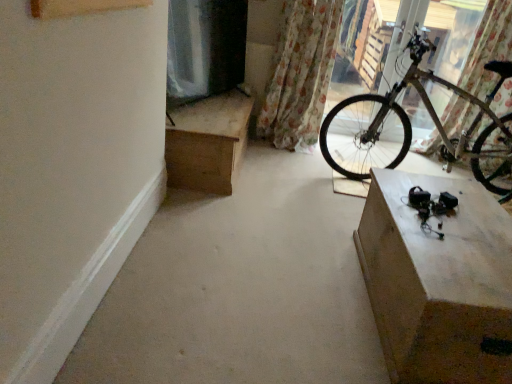
Question: Is wooden desk at upper left positioned beyond the bounds of floral fabric curtain at upper right, which appears as the 2th curtain when viewed from the left?

Choices:
 (A) no
 (B) yes

Answer: (B)

Question: Can you confirm if wooden desk at upper left is wider than floral fabric curtain at upper right, which appears as the 2th curtain when viewed from the left?

Choices:
 (A) yes
 (B) no

Answer: (A)

Question: From the image's perspective, is wooden desk at upper left under floral fabric curtain at upper right, which appears as the 2th curtain when viewed from the left?

Choices:
 (A) no
 (B) yes

Answer: (B)

Question: From the image's perspective, is wooden desk at upper left located above floral fabric curtain at upper right, which appears as the 2th curtain when viewed from the left?

Choices:
 (A) no
 (B) yes

Answer: (A)

Question: Is wooden desk at upper left positioned with its back to floral fabric curtain at upper right, which appears as the 2th curtain when viewed from the left?

Choices:
 (A) no
 (B) yes

Answer: (A)

Question: Is matte concrete cabinet at lower right inside the boundaries of wooden desk at upper left, or outside?

Choices:
 (A) outside
 (B) inside

Answer: (A)

Question: Considering the positions of matte concrete cabinet at lower right and wooden desk at upper left in the image, is matte concrete cabinet at lower right taller or shorter than wooden desk at upper left?

Choices:
 (A) short
 (B) tall

Answer: (A)

Question: In terms of width, does matte concrete cabinet at lower right look wider or thinner when compared to wooden desk at upper left?

Choices:
 (A) wide
 (B) thin

Answer: (B)

Question: From a real-world perspective, is matte concrete cabinet at lower right above or below wooden desk at upper left?

Choices:
 (A) below
 (B) above

Answer: (A)

Question: Is metallic silver bicycle at right bigger or smaller than floral fabric curtain at upper right, which ranks as the 2th curtain in right-to-left order?

Choices:
 (A) small
 (B) big

Answer: (B)

Question: Considering the positions of metallic silver bicycle at right and floral fabric curtain at upper right, which is the first curtain in left-to-right order, in the image, is metallic silver bicycle at right taller or shorter than floral fabric curtain at upper right, which is the first curtain in left-to-right order,?

Choices:
 (A) tall
 (B) short

Answer: (B)

Question: Considering the positions of metallic silver bicycle at right and floral fabric curtain at upper right, which is the first curtain in left-to-right order, in the image, is metallic silver bicycle at right wider or thinner than floral fabric curtain at upper right, which is the first curtain in left-to-right order,?

Choices:
 (A) wide
 (B) thin

Answer: (A)

Question: Relative to floral fabric curtain at upper right, which ranks as the 2th curtain in right-to-left order, is metallic silver bicycle at right in front or behind?

Choices:
 (A) behind
 (B) front

Answer: (B)

Question: Do you think matte concrete cabinet at lower right is within floral fabric curtain at upper right, which appears as the 2th curtain when viewed from the left, or outside of it?

Choices:
 (A) inside
 (B) outside

Answer: (B)

Question: Considering their positions, is matte concrete cabinet at lower right located in front of or behind floral fabric curtain at upper right, marked as the first curtain in a right-to-left arrangement?

Choices:
 (A) front
 (B) behind

Answer: (A)